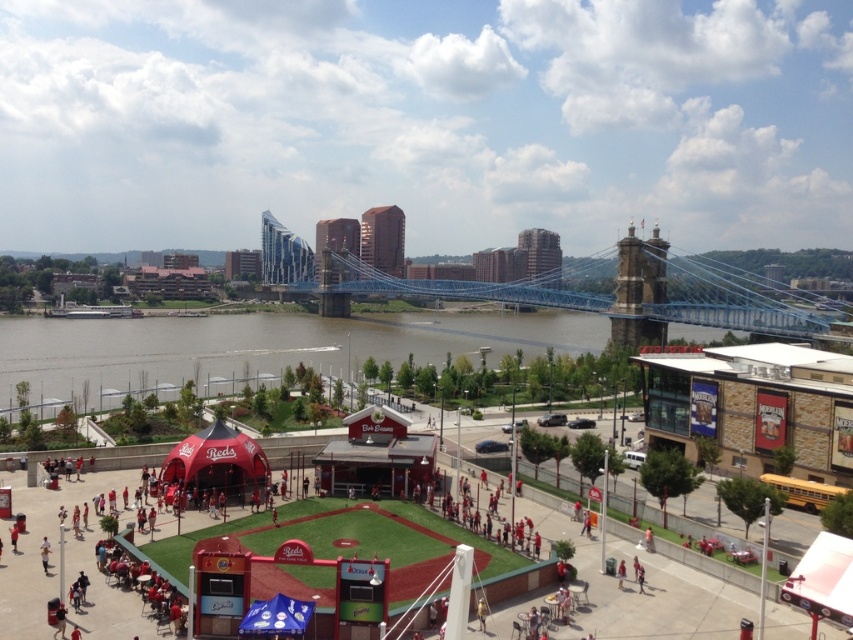
You are standing at the point marked by the coordinates point (257,346). What object are you currently standing on?

You are standing on the red fabric tent at center.